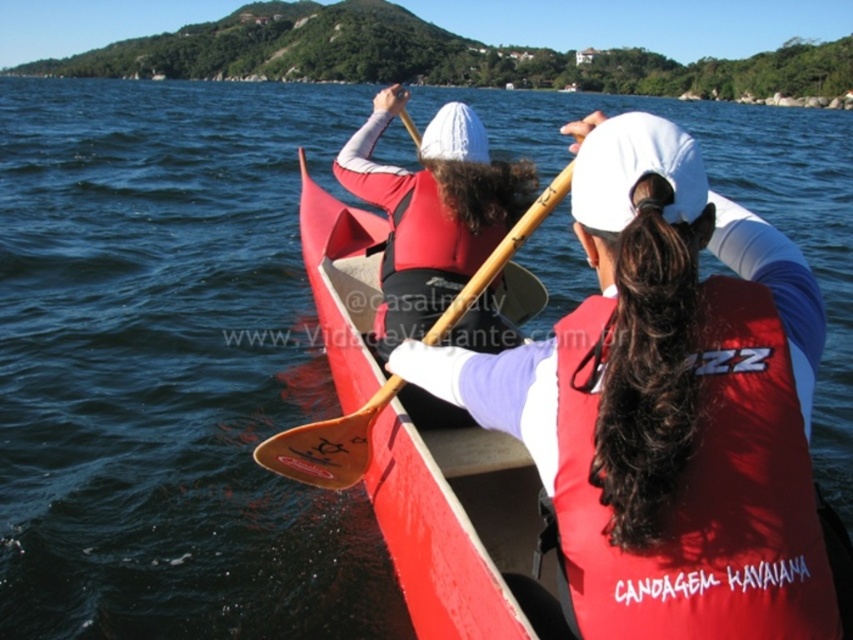
Between red matte life jacket at center and wooden paddle at center, which one appears on the left side from the viewer's perspective?

wooden paddle at center is more to the left.

From the picture: Is red matte life jacket at center positioned at the back of wooden paddle at center?

No, red matte life jacket at center is in front of wooden paddle at center.

Where is `red matte life jacket at center`? Image resolution: width=853 pixels, height=640 pixels. red matte life jacket at center is located at coordinates (699, 492).